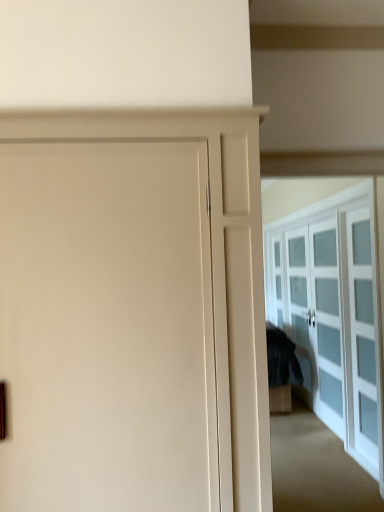
Question: Does white glass cabinet at right have a greater width compared to matte white door at center?

Choices:
 (A) no
 (B) yes

Answer: (A)

Question: Is white glass cabinet at right outside matte white door at center?

Choices:
 (A) no
 (B) yes

Answer: (B)

Question: Can you confirm if white glass cabinet at right is bigger than matte white door at center?

Choices:
 (A) no
 (B) yes

Answer: (A)

Question: Considering the relative positions of white glass cabinet at right and matte white door at center in the image provided, is white glass cabinet at right behind matte white door at center?

Choices:
 (A) yes
 (B) no

Answer: (A)

Question: Does white glass cabinet at right have a lesser width compared to matte white door at center?

Choices:
 (A) yes
 (B) no

Answer: (A)

Question: Is the depth of white glass cabinet at right less than that of matte white door at center?

Choices:
 (A) yes
 (B) no

Answer: (B)

Question: From a real-world perspective, is matte white door at center physically below white glass cabinet at right?

Choices:
 (A) no
 (B) yes

Answer: (A)

Question: Does matte white door at center lie behind white glass cabinet at right?

Choices:
 (A) no
 (B) yes

Answer: (A)

Question: Is matte white door at center thinner than white glass cabinet at right?

Choices:
 (A) no
 (B) yes

Answer: (A)

Question: Is matte white door at center looking in the opposite direction of white glass cabinet at right?

Choices:
 (A) yes
 (B) no

Answer: (B)

Question: Is matte white door at center oriented towards white glass cabinet at right?

Choices:
 (A) no
 (B) yes

Answer: (A)

Question: Is matte white door at center taller than white glass cabinet at right?

Choices:
 (A) no
 (B) yes

Answer: (B)

Question: From a real-world perspective, is white glass cabinet at right physically located above or below matte white door at center?

Choices:
 (A) above
 (B) below

Answer: (B)